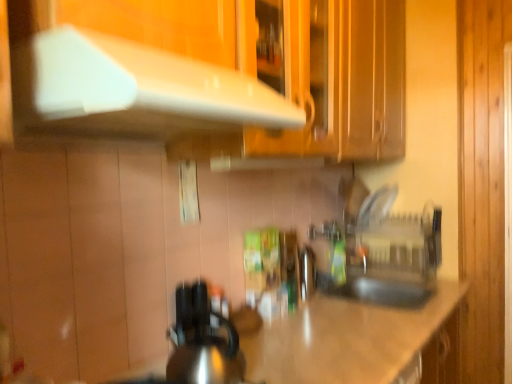
The image size is (512, 384). What do you see at coordinates (339, 259) in the screenshot?
I see `green matte bottle at center` at bounding box center [339, 259].

Image resolution: width=512 pixels, height=384 pixels. I want to click on shiny metallic kettle at center, so click(x=202, y=341).

You are a GUI agent. You are given a task and a screenshot of the screen. Output one action in this format:
    pyautogui.click(x=<x>, y=<y>)
    Task: Click on the white glossy exhaust hood at upper center
    The width and height of the screenshot is (512, 384).
    Given the screenshot: What is the action you would take?
    pyautogui.click(x=137, y=89)

The height and width of the screenshot is (384, 512). I want to click on transparent plastic sink at center, so click(387, 259).

Is shiny metallic countertop at center surrounded by shiny metallic kettle at center?

No, shiny metallic countertop at center is not surrounded by shiny metallic kettle at center.

How many degrees apart are the facing directions of shiny metallic kettle at center and shiny metallic countertop at center?

There is a 1.31-degree angle between the facing directions of shiny metallic kettle at center and shiny metallic countertop at center.

Considering the sizes of objects shiny metallic kettle at center and shiny metallic countertop at center in the image provided, who is taller, shiny metallic kettle at center or shiny metallic countertop at center?

With more height is shiny metallic countertop at center.

Can shiny metallic countertop at center be found inside white glossy exhaust hood at upper center?

No, shiny metallic countertop at center is not inside white glossy exhaust hood at upper center.

Is there a large distance between white glossy exhaust hood at upper center and shiny metallic countertop at center?

white glossy exhaust hood at upper center is actually quite close to shiny metallic countertop at center.

How many degrees apart are the facing directions of white glossy exhaust hood at upper center and shiny metallic countertop at center?

There is a 0.607-degree angle between the facing directions of white glossy exhaust hood at upper center and shiny metallic countertop at center.

Between white glossy exhaust hood at upper center and shiny metallic countertop at center, which one has larger width?

Wider between the two is shiny metallic countertop at center.

Between shiny metallic countertop at center and green matte bottle at center, which one has smaller width?

green matte bottle at center.

From the image's perspective, which one is positioned higher, shiny metallic countertop at center or green matte bottle at center?

green matte bottle at center appears higher in the image.

Is shiny metallic countertop at center turned away from green matte bottle at center?

That's not correct — shiny metallic countertop at center is not looking away from green matte bottle at center.

Who is bigger, shiny metallic countertop at center or green matte bottle at center?

Bigger between the two is shiny metallic countertop at center.

Which object is more forward, shiny metallic kettle at center or green matte bottle at center?

shiny metallic kettle at center is in front.

Which is more to the left, shiny metallic kettle at center or green matte bottle at center?

Positioned to the left is shiny metallic kettle at center.

Could you tell me if shiny metallic kettle at center is turned towards green matte bottle at center?

No, shiny metallic kettle at center is not facing towards green matte bottle at center.

Considering the relative sizes of shiny metallic kettle at center and green matte bottle at center in the image provided, is shiny metallic kettle at center wider than green matte bottle at center?

Yes.

Is shiny metallic countertop at center thinner than shiny metallic kettle at center?

No.

Is shiny metallic countertop at center outside of shiny metallic kettle at center?

Yes, shiny metallic countertop at center is located beyond the bounds of shiny metallic kettle at center.

Find the location of `countertop behind the shiny metallic kettle at center`. countertop behind the shiny metallic kettle at center is located at coordinates (345, 340).

Are shiny metallic countertop at center and shiny metallic kettle at center making contact?

No.

In terms of height, does transparent plastic sink at center look taller or shorter compared to white glossy exhaust hood at upper center?

transparent plastic sink at center is taller than white glossy exhaust hood at upper center.

Does transparent plastic sink at center appear on the left side of white glossy exhaust hood at upper center?

In fact, transparent plastic sink at center is to the right of white glossy exhaust hood at upper center.

Choose the correct answer: Is transparent plastic sink at center inside white glossy exhaust hood at upper center or outside it?

transparent plastic sink at center is not enclosed by white glossy exhaust hood at upper center.

Consider the image. Which object is thinner, transparent plastic sink at center or white glossy exhaust hood at upper center?

transparent plastic sink at center.

Is point (389, 287) in front of point (345, 246)?

Yes, point (389, 287) is closer to viewer.

Is transparent plastic sink at center next to green matte bottle at center?

There is a gap between transparent plastic sink at center and green matte bottle at center.

Considering the sizes of transparent plastic sink at center and green matte bottle at center in the image, is transparent plastic sink at center bigger or smaller than green matte bottle at center?

Clearly, transparent plastic sink at center is larger in size than green matte bottle at center.

Looking at their sizes, would you say transparent plastic sink at center is wider or thinner than green matte bottle at center?

Clearly, transparent plastic sink at center has more width compared to green matte bottle at center.

There is a shiny metallic countertop at center. Find the location of `kitchen appliance above it (from a real-world perspective)`. kitchen appliance above it (from a real-world perspective) is located at coordinates (202, 341).

Identify the location of exhaust hood on the left of shiny metallic countertop at center. (137, 89).

Considering their positions, is shiny metallic countertop at center positioned further to white glossy exhaust hood at upper center than shiny metallic kettle at center?

shiny metallic countertop at center lies further to white glossy exhaust hood at upper center than the other object.

Considering their positions, is transparent plastic sink at center positioned closer to green matte bottle at center than shiny metallic kettle at center?

transparent plastic sink at center is closer to green matte bottle at center.

Which object lies nearer to the anchor point shiny metallic countertop at center, white glossy exhaust hood at upper center or green matte bottle at center?

green matte bottle at center is closer to shiny metallic countertop at center.

Looking at the image, which one is located further to white glossy exhaust hood at upper center, green matte bottle at center or shiny metallic kettle at center?

Based on the image, green matte bottle at center appears to be further to white glossy exhaust hood at upper center.

In the scene shown: When comparing their distances from shiny metallic kettle at center, does transparent plastic sink at center or shiny metallic countertop at center seem closer?

shiny metallic countertop at center lies closer to shiny metallic kettle at center than the other object.

Based on their spatial positions, is shiny metallic countertop at center or transparent plastic sink at center further from white glossy exhaust hood at upper center?

transparent plastic sink at center is positioned further to the anchor white glossy exhaust hood at upper center.

Looking at the image, which one is located closer to transparent plastic sink at center, shiny metallic kettle at center or green matte bottle at center?

green matte bottle at center lies closer to transparent plastic sink at center than the other object.

Which object lies further to the anchor point shiny metallic countertop at center, transparent plastic sink at center or white glossy exhaust hood at upper center?

The object further to shiny metallic countertop at center is white glossy exhaust hood at upper center.

You are a GUI agent. You are given a task and a screenshot of the screen. Output one action in this format:
    pyautogui.click(x=<x>, y=<y>)
    Task: Click on the countertop between white glossy exhaust hood at upper center and transparent plastic sink at center from front to back
    The image size is (512, 384).
    Given the screenshot: What is the action you would take?
    [345, 340]

Locate an element on the screen. The height and width of the screenshot is (384, 512). kitchen appliance between white glossy exhaust hood at upper center and green matte bottle at center along the z-axis is located at coordinates (202, 341).

Identify the location of countertop located between white glossy exhaust hood at upper center and green matte bottle at center in the depth direction. (x=345, y=340).

Find the location of a particular element. The width and height of the screenshot is (512, 384). sink positioned between shiny metallic countertop at center and green matte bottle at center from near to far is located at coordinates (387, 259).